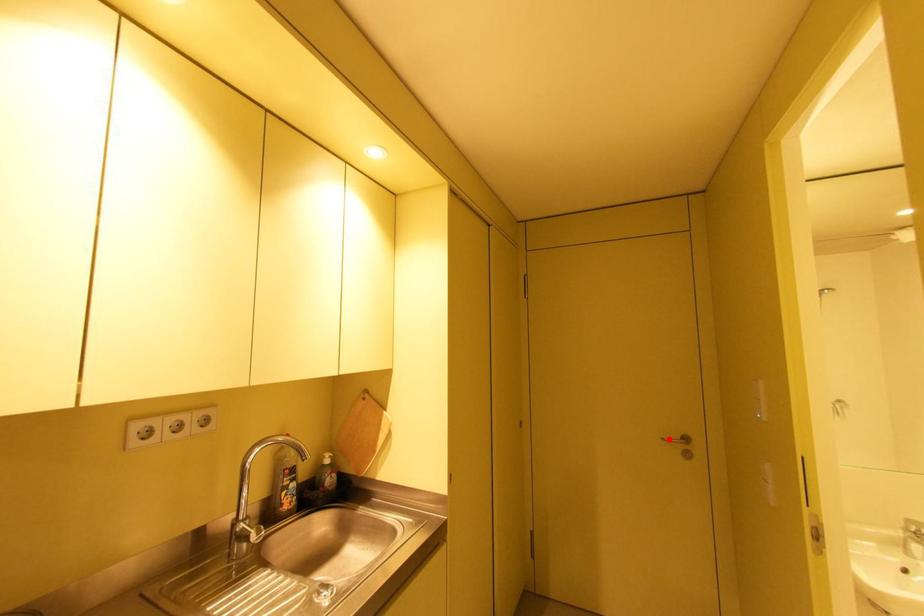
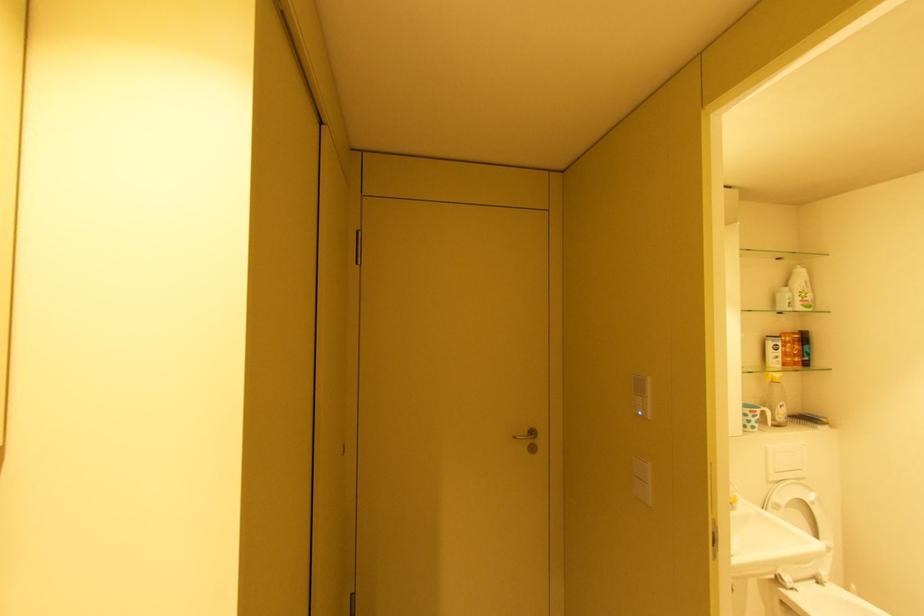
Where in the second image is the point corresponding to the highlighted location from the first image?

(520, 438)